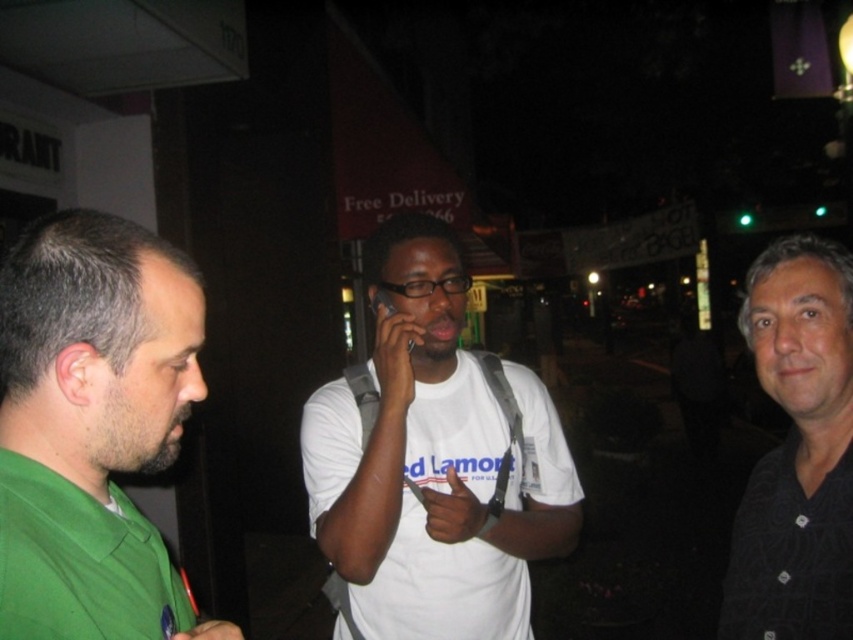
Question: Observing the image, what is the correct spatial positioning of white matte t-shirt at center in reference to green matte shirt at left?

Choices:
 (A) below
 (B) above

Answer: (A)

Question: Which point is closer to the camera?

Choices:
 (A) (384, 305)
 (B) (22, 444)
 (C) (345, 499)

Answer: (B)

Question: Which object appears closest to the camera in this image?

Choices:
 (A) black matte shirt at right
 (B) green matte shirt at left
 (C) white matte t-shirt at center
 (D) black plastic phone at center

Answer: (B)

Question: Is white matte t-shirt at center to the left of black plastic phone at center from the viewer's perspective?

Choices:
 (A) no
 (B) yes

Answer: (A)

Question: Which object is closer to the camera taking this photo?

Choices:
 (A) white matte t-shirt at center
 (B) black matte shirt at right
 (C) black plastic phone at center
 (D) green matte shirt at left

Answer: (D)

Question: Does white matte t-shirt at center have a larger size compared to green matte shirt at left?

Choices:
 (A) no
 (B) yes

Answer: (B)